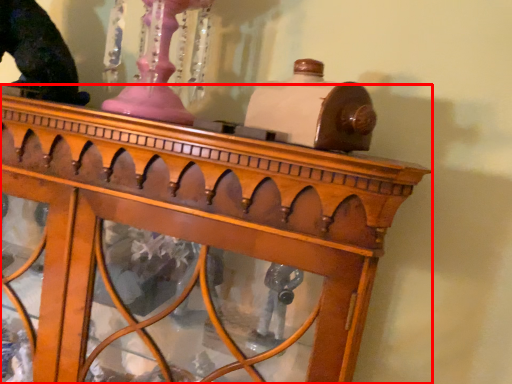
Question: From the image's perspective, where is furniture (annotated by the red box) located relative to animal?

Choices:
 (A) below
 (B) above

Answer: (A)